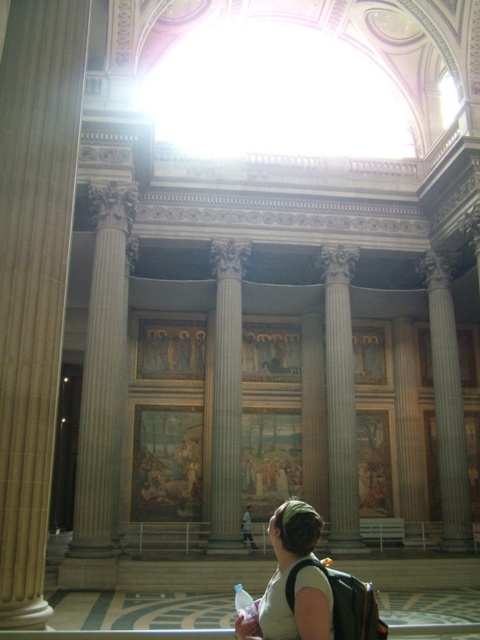
Is point (37, 204) positioned in front of point (324, 625)?

No, it is not.

Describe the element at coordinates (34, 276) in the screenshot. I see `smooth beige column at left` at that location.

Does point (12, 246) come in front of point (278, 614)?

No.

The width and height of the screenshot is (480, 640). What are the coordinates of `smooth beige column at left` in the screenshot? It's located at (34, 276).

Between smooth marble column at center and gray marble column at right, which one has less height?

With less height is smooth marble column at center.

Identify the location of smooth marble column at center. Image resolution: width=480 pixels, height=640 pixels. (227, 396).

What do you see at coordinates (227, 396) in the screenshot? Image resolution: width=480 pixels, height=640 pixels. I see `smooth marble column at center` at bounding box center [227, 396].

Find the location of a particular element. The image size is (480, 640). smooth marble column at center is located at coordinates (227, 396).

Is smooth beige column at left in front of gray marble column at right?

Yes, it is.

Is smooth beige column at left positioned at the back of gray marble column at right?

No, smooth beige column at left is in front of gray marble column at right.

Does point (16, 592) lie in front of point (465, 468)?

Yes, point (16, 592) is in front of point (465, 468).

I want to click on smooth beige column at left, so click(x=34, y=276).